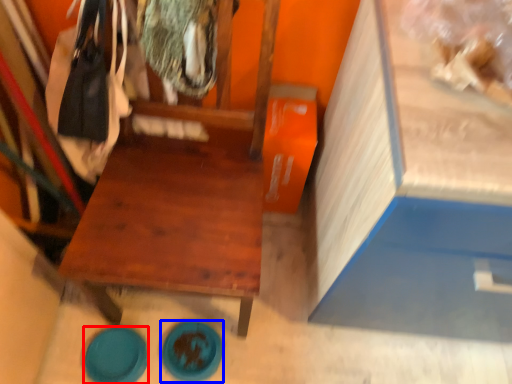
Question: Among these objects, which one is nearest to the camera, plate (highlighted by a red box) or plate (highlighted by a blue box)?

Choices:
 (A) plate
 (B) plate

Answer: (A)